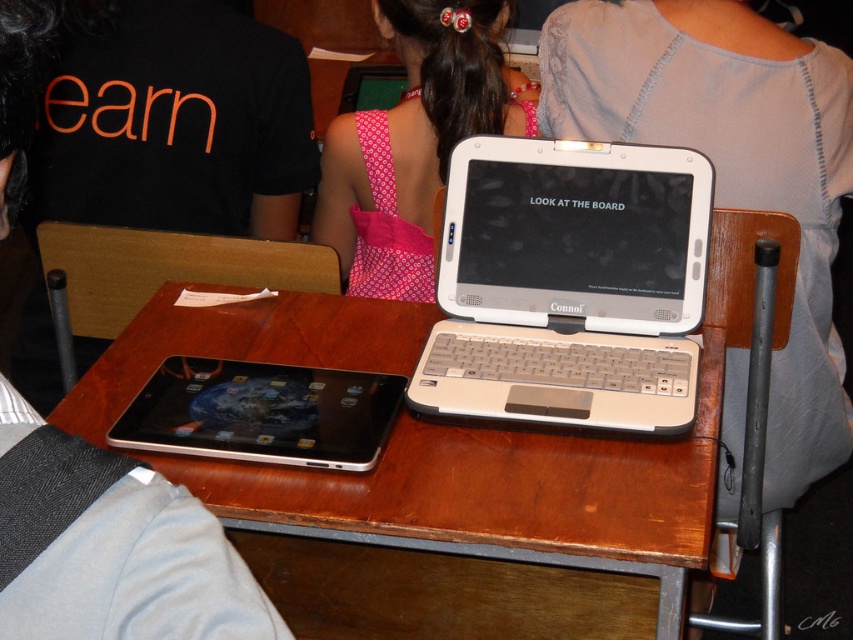
Question: Does wooden table at center come behind pink fabric dress at upper center?

Choices:
 (A) yes
 (B) no

Answer: (B)

Question: Which point is farther to the camera?

Choices:
 (A) black matte shirt at upper left
 (B) silver metallic tablet at center
 (C) pink fabric dress at upper center
 (D) wooden table at center

Answer: (C)

Question: Which is farther from the black matte shirt at upper left?

Choices:
 (A) white plastic laptop at center
 (B) silver metallic tablet at center
 (C) wooden table at center

Answer: (A)

Question: Can you confirm if wooden table at center is positioned below pink fabric dress at upper center?

Choices:
 (A) yes
 (B) no

Answer: (A)

Question: Which of the following is the closest to the observer?

Choices:
 (A) (508, 124)
 (B) (293, 378)

Answer: (B)

Question: Can you confirm if wooden table at center is bigger than silver metallic tablet at center?

Choices:
 (A) yes
 (B) no

Answer: (A)